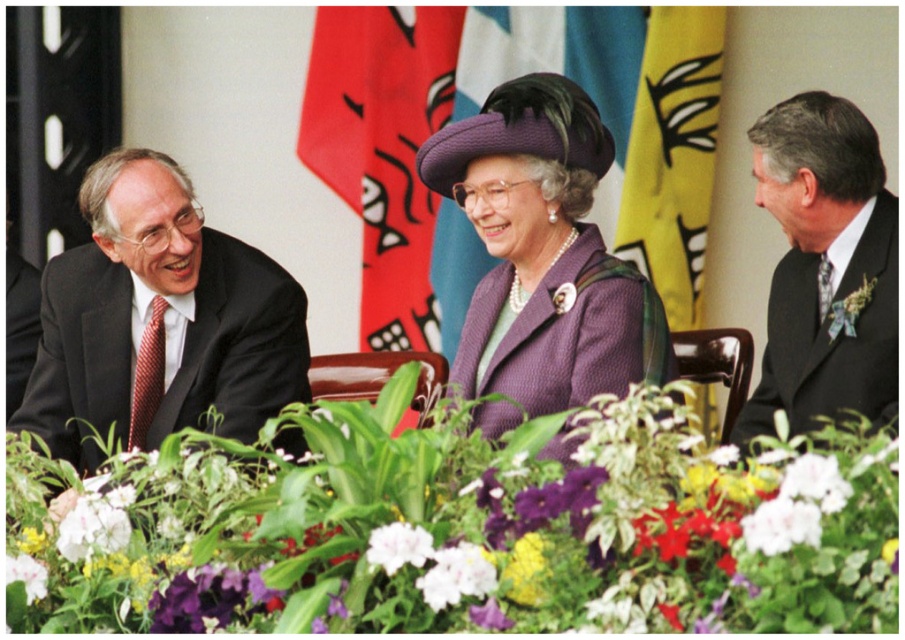
Consider the image. Which is more to the right, purple woolen coat at center or white matte flower at center?

purple woolen coat at center is more to the right.

Between purple woolen coat at center and white matte flower at center, which one is positioned higher?

Positioned higher is purple woolen coat at center.

Between point (555, 218) and point (426, 557), which one is positioned behind?

The point (555, 218) is behind.

This screenshot has width=905, height=640. I want to click on purple woolen coat at center, so click(x=543, y=257).

How far apart are purple textured coat at center and dark gray suit at right?

A distance of 34.75 inches exists between purple textured coat at center and dark gray suit at right.

Does point (845, 369) come closer to viewer compared to point (896, 328)?

No, it is not.

Locate an element on the screen. This screenshot has height=640, width=905. purple textured coat at center is located at coordinates (534, 252).

Does point (402, 484) come in front of point (512, 344)?

Yes, point (402, 484) is in front of point (512, 344).

Does vivid purple petals at center have a lesser width compared to purple woolen coat at center?

No, vivid purple petals at center is not thinner than purple woolen coat at center.

Who is more forward, (812, 458) or (497, 426)?

Point (812, 458) is more forward.

The width and height of the screenshot is (905, 640). What are the coordinates of `vivid purple petals at center` in the screenshot? It's located at (463, 529).